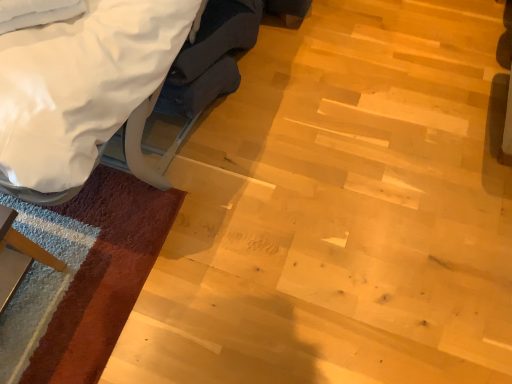
Question: Should I look upward or downward to see white fabric swivel chair at upper left?

Choices:
 (A) up
 (B) down

Answer: (A)